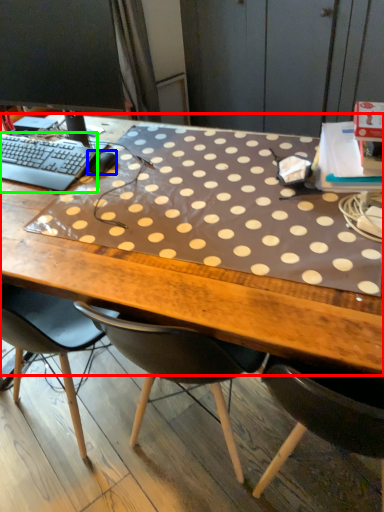
Question: Estimate the real-world distances between objects in this image. Which object is farther from desk (highlighted by a red box), mouse (highlighted by a blue box) or computer keyboard (highlighted by a green box)?

Choices:
 (A) mouse
 (B) computer keyboard

Answer: (A)